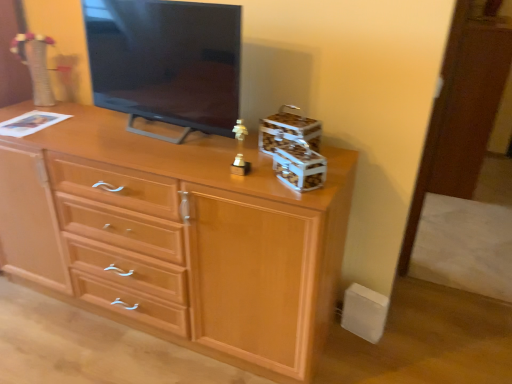
Question: Can wooden storage box at upper right, the first storage box in the back-to-front sequence, be found inside matte black tv at center?

Choices:
 (A) yes
 (B) no

Answer: (B)

Question: Is wooden storage box at upper right, which ranks as the 2th storage box in front-to-back order, at the back of matte black tv at center?

Choices:
 (A) no
 (B) yes

Answer: (A)

Question: Does matte black tv at center have a lesser height compared to wooden storage box at upper right, which ranks as the 2th storage box in front-to-back order?

Choices:
 (A) no
 (B) yes

Answer: (A)

Question: From a real-world perspective, is matte black tv at center under wooden storage box at upper right, which ranks as the 2th storage box in front-to-back order?

Choices:
 (A) no
 (B) yes

Answer: (A)

Question: Is matte black tv at center far away from wooden storage box at upper right, which ranks as the 2th storage box in front-to-back order?

Choices:
 (A) no
 (B) yes

Answer: (A)

Question: Considering the positions of wooden storage box at upper right, the first storage box in the back-to-front sequence, and matte black tv at center in the image, is wooden storage box at upper right, the first storage box in the back-to-front sequence, bigger or smaller than matte black tv at center?

Choices:
 (A) big
 (B) small

Answer: (B)

Question: Does point (298, 120) appear closer or farther from the camera than point (158, 109)?

Choices:
 (A) farther
 (B) closer

Answer: (B)

Question: In the image, is wooden storage box at upper right, which ranks as the 2th storage box in front-to-back order, on the left side or the right side of matte black tv at center?

Choices:
 (A) right
 (B) left

Answer: (A)

Question: In terms of width, does wooden storage box at upper right, which ranks as the 2th storage box in front-to-back order, look wider or thinner when compared to matte black tv at center?

Choices:
 (A) wide
 (B) thin

Answer: (B)

Question: From a real-world perspective, is wooden storage box at upper right, the first storage box in the back-to-front sequence, positioned above or below metallic silver storage box at center-right, placed as the 1th storage box when sorted from front to back?

Choices:
 (A) above
 (B) below

Answer: (A)

Question: In terms of size, does wooden storage box at upper right, the first storage box in the back-to-front sequence, appear bigger or smaller than metallic silver storage box at center-right, marked as the second storage box in a back-to-front arrangement?

Choices:
 (A) small
 (B) big

Answer: (B)

Question: In terms of height, does wooden storage box at upper right, which ranks as the 2th storage box in front-to-back order, look taller or shorter compared to metallic silver storage box at center-right, placed as the 1th storage box when sorted from front to back?

Choices:
 (A) tall
 (B) short

Answer: (A)

Question: Would you say wooden storage box at upper right, the first storage box in the back-to-front sequence, is to the left or to the right of metallic silver storage box at center-right, marked as the second storage box in a back-to-front arrangement, in the picture?

Choices:
 (A) left
 (B) right

Answer: (A)

Question: Is wooden storage box at upper right, the first storage box in the back-to-front sequence, taller or shorter than light wood chest of drawers at center?

Choices:
 (A) short
 (B) tall

Answer: (A)

Question: Considering the relative positions of wooden storage box at upper right, which ranks as the 2th storage box in front-to-back order, and light wood chest of drawers at center in the image provided, is wooden storage box at upper right, which ranks as the 2th storage box in front-to-back order, to the left or to the right of light wood chest of drawers at center?

Choices:
 (A) left
 (B) right

Answer: (B)